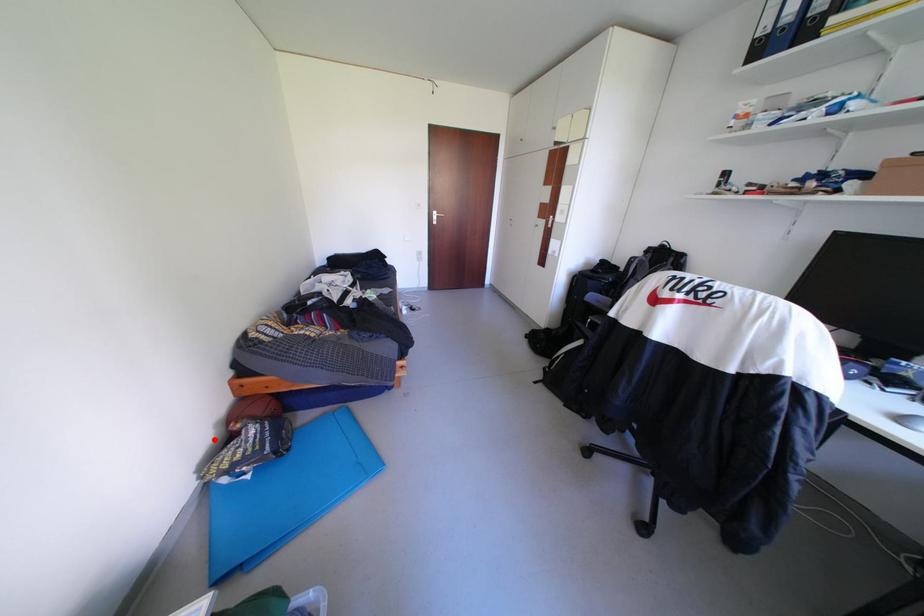
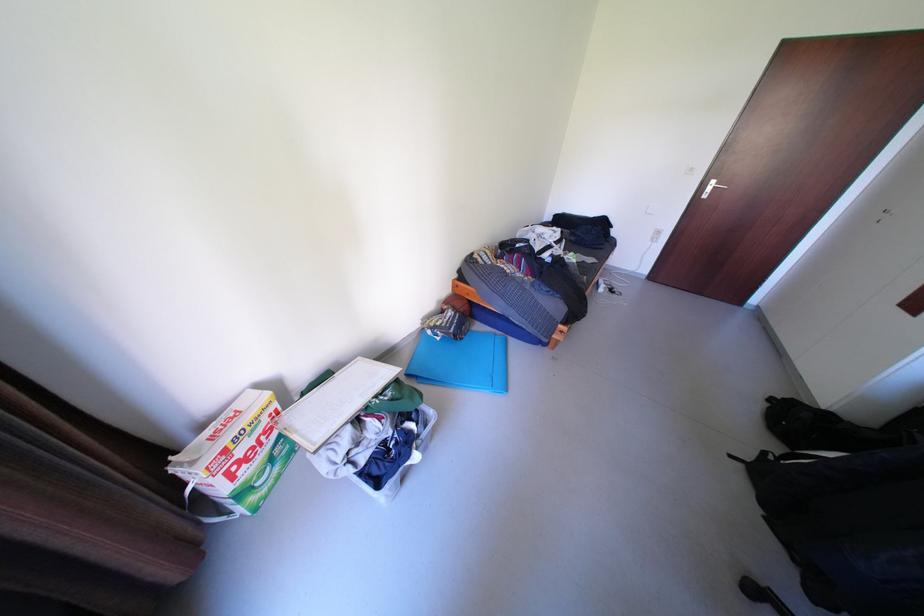
Question: I am providing you with two images of the same scene from different viewpoints. Image1 has a red point marked. In image2, the corresponding 3D location appears at what relative position? Reply with the corresponding letter.

Choices:
 (A) Closer
 (B) Farther

Answer: (B)